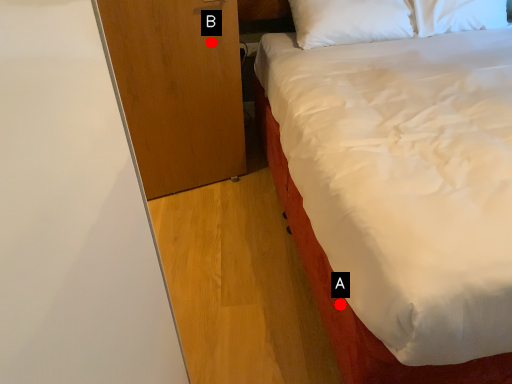
Question: Two points are circled on the image, labeled by A and B beside each circle. Which point is closer to the camera?

Choices:
 (A) A is closer
 (B) B is closer

Answer: (A)